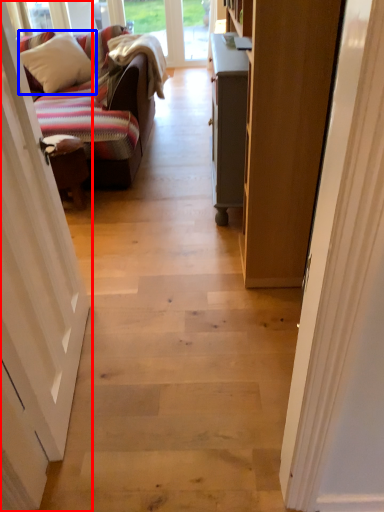
Question: Which object is further to the camera taking this photo, door (highlighted by a red box) or pillow (highlighted by a blue box)?

Choices:
 (A) door
 (B) pillow

Answer: (B)